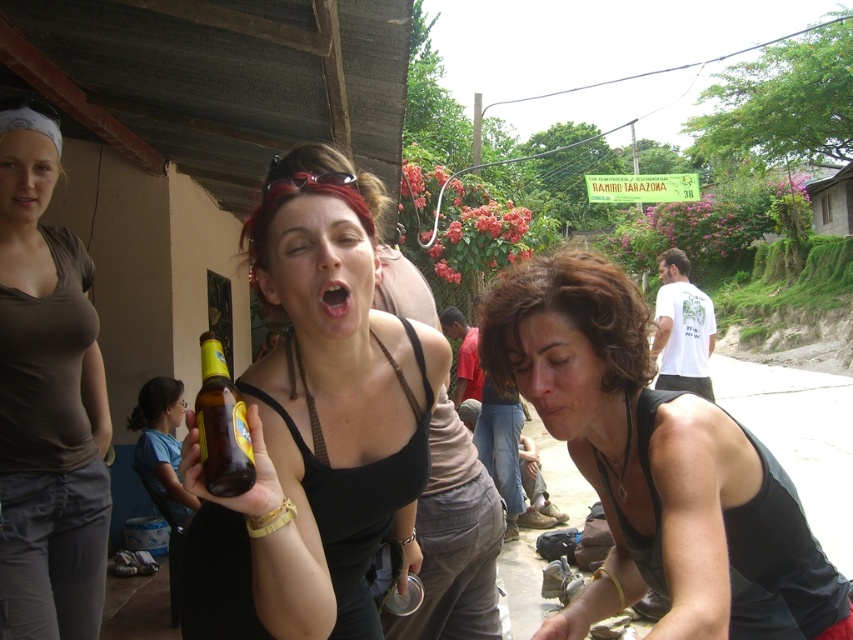
In the scene shown: You are at a social gathering and see a translucent glass bottle at center and a blue fabric shirt at lower left. Which object is positioned higher in the image?

The translucent glass bottle at center is positioned higher than the blue fabric shirt at lower left according to the description.

You are standing at the point marked by the coordinates point [659,468]. Which object is directly in front of you?

The point [659,468] corresponds to the black matte tank top at lower right, so the black matte tank top at lower right is directly in front of you.

You are at a social gathering and want to find the person wearing the black matte tank top at lower right. Which direction should you look from the dark brown hair at center?

You should look to the right from the dark brown hair at center to find the black matte tank top at lower right because the black matte tank top at lower right is positioned to the right of dark brown hair at center.